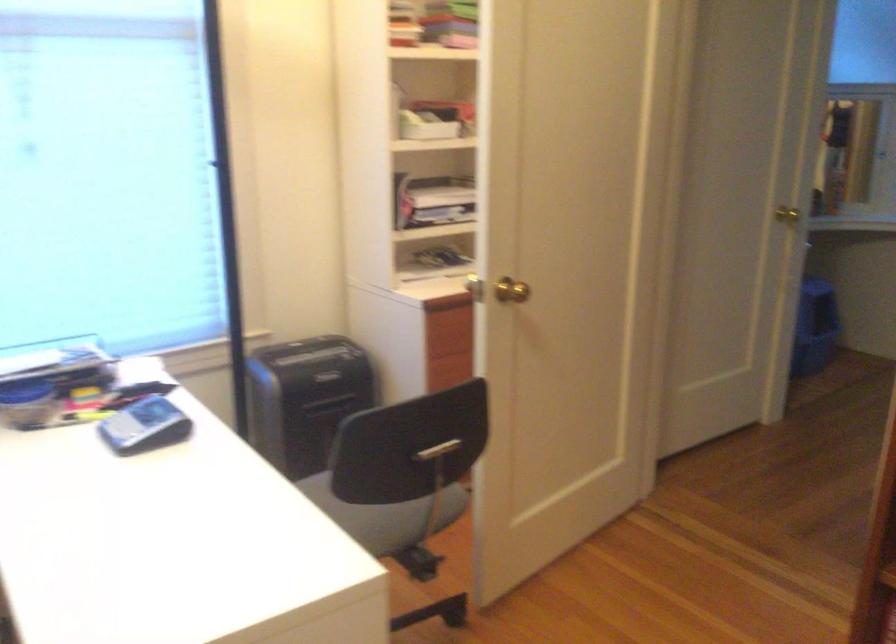
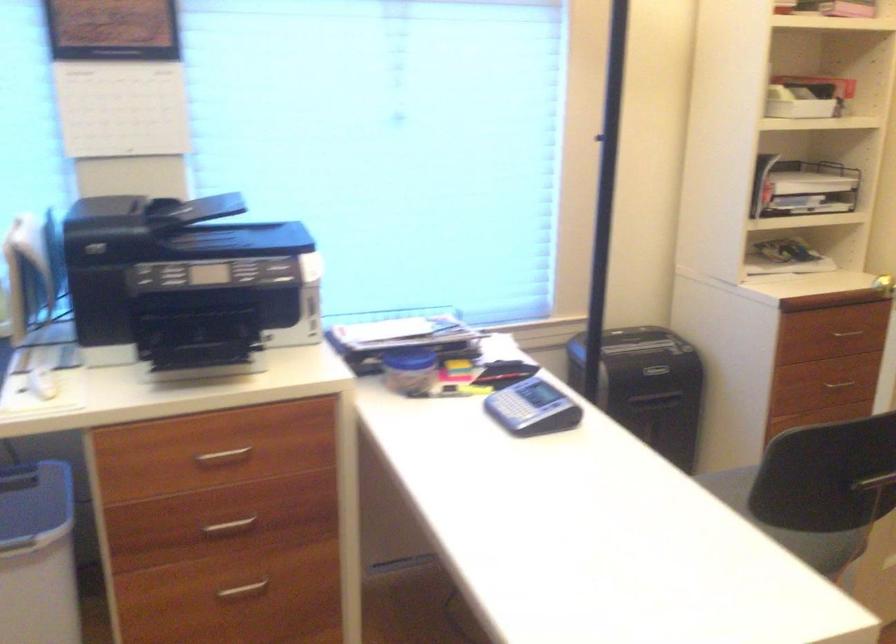
Question: The images are taken continuously from a first-person perspective. In which direction are you moving?

Choices:
 (A) Left
 (B) Right
 (C) Forward
 (D) Backward

Answer: (A)